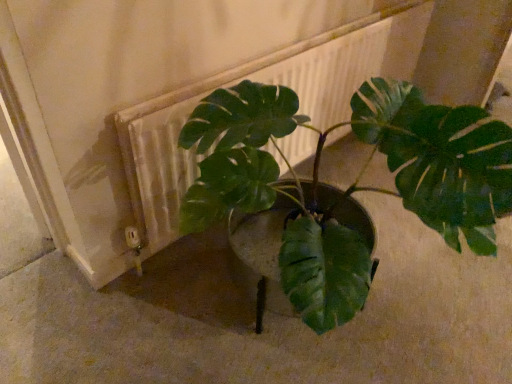
What do you see at coordinates (229, 86) in the screenshot?
I see `white textured radiator at center` at bounding box center [229, 86].

Locate an element on the screen. This screenshot has width=512, height=384. white textured radiator at center is located at coordinates (229, 86).

In order to face green matte plant at center, should I rotate leftwards or rightwards?

You should look right and rotate roughly 10.601 degrees.

Identify the location of green matte plant at center. (350, 186).

This screenshot has width=512, height=384. Describe the element at coordinates (350, 186) in the screenshot. I see `green matte plant at center` at that location.

Locate an element on the screen. This screenshot has height=384, width=512. white textured radiator at center is located at coordinates (229, 86).

Does green matte plant at center appear on the left side of white textured radiator at center?

Correct, you'll find green matte plant at center to the left of white textured radiator at center.

Is green matte plant at center in front of or behind white textured radiator at center in the image?

green matte plant at center is in front of white textured radiator at center.

Considering the positions of points (472, 176) and (147, 163), is point (472, 176) closer to camera compared to point (147, 163)?

Yes, it is in front of point (147, 163).

From the image's perspective, which object appears higher, green matte plant at center or white textured radiator at center?

white textured radiator at center appears higher in the image.

From a real-world perspective, is green matte plant at center positioned above or below white textured radiator at center?

From a real-world perspective, green matte plant at center is physically above white textured radiator at center.

Is green matte plant at center wider or thinner than white textured radiator at center?

In the image, green matte plant at center appears to be wider than white textured radiator at center.

From their relative heights in the image, would you say green matte plant at center is taller or shorter than white textured radiator at center?

In the image, green matte plant at center appears to be taller than white textured radiator at center.

Considering the sizes of green matte plant at center and white textured radiator at center in the image, is green matte plant at center bigger or smaller than white textured radiator at center?

In the image, green matte plant at center appears to be larger than white textured radiator at center.

Would you say green matte plant at center is outside white textured radiator at center?

green matte plant at center is positioned outside white textured radiator at center.

Are green matte plant at center and white textured radiator at center making contact?

No, green matte plant at center is not beside white textured radiator at center.

Is white textured radiator at center at the back of green matte plant at center?

Yes, green matte plant at center is facing away from white textured radiator at center.

What's the angular difference between green matte plant at center and white textured radiator at center's facing directions?

The angular difference between green matte plant at center and white textured radiator at center is 0.747 degrees.

The height and width of the screenshot is (384, 512). I want to click on houseplant in front of the white textured radiator at center, so click(x=350, y=186).

Is white textured radiator at center to the right of green matte plant at center from the viewer's perspective?

Indeed, white textured radiator at center is positioned on the right side of green matte plant at center.

Is white textured radiator at center closer to camera compared to green matte plant at center?

That is False.

Is point (357, 37) less distant than point (233, 181)?

No, it is behind (233, 181).

From the image's perspective, which is below, white textured radiator at center or green matte plant at center?

green matte plant at center, from the image's perspective.

From a real-world perspective, is white textured radiator at center beneath green matte plant at center?

Yes, from a real-world perspective, white textured radiator at center is under green matte plant at center.

Considering the relative sizes of white textured radiator at center and green matte plant at center in the image provided, is white textured radiator at center thinner than green matte plant at center?

Indeed, white textured radiator at center has a lesser width compared to green matte plant at center.

Between white textured radiator at center and green matte plant at center, which one has more height?

Standing taller between the two is green matte plant at center.

Considering the sizes of objects white textured radiator at center and green matte plant at center in the image provided, who is bigger, white textured radiator at center or green matte plant at center?

green matte plant at center.

Is white textured radiator at center not within green matte plant at center?

Yes, white textured radiator at center is located beyond the bounds of green matte plant at center.

Is there a large distance between white textured radiator at center and green matte plant at center?

No.

Is green matte plant at center at the back of white textured radiator at center?

That's right, white textured radiator at center is facing away from green matte plant at center.

How many degrees apart are the facing directions of white textured radiator at center and green matte plant at center?

The facing directions of white textured radiator at center and green matte plant at center are 0.747 degrees apart.

The width and height of the screenshot is (512, 384). Identify the location of houseplant below the white textured radiator at center (from the image's perspective). (350, 186).

Identify the location of houseplant that appears below the white textured radiator at center (from the image's perspective). (350, 186).

The image size is (512, 384). In order to click on houseplant in front of the white textured radiator at center in this screenshot , I will do `click(350, 186)`.